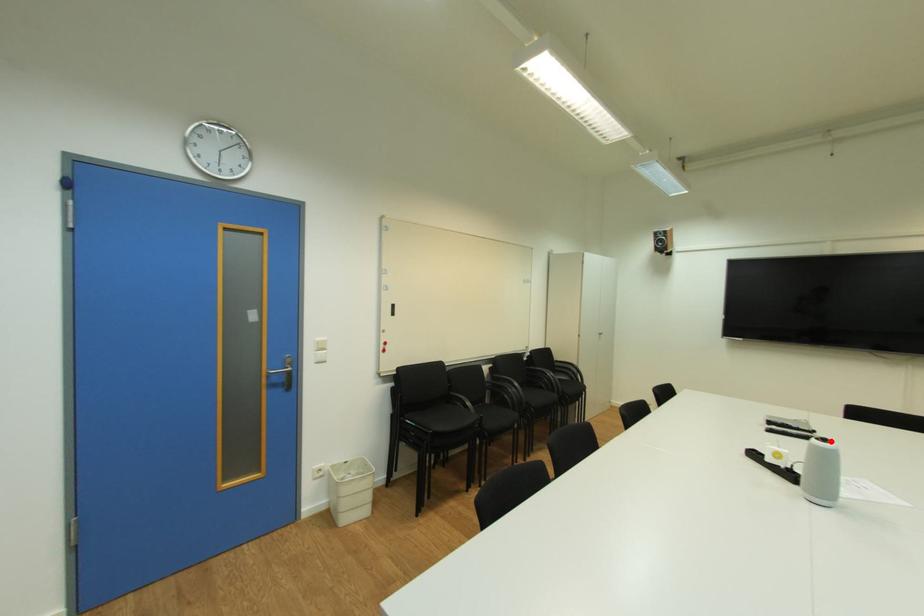
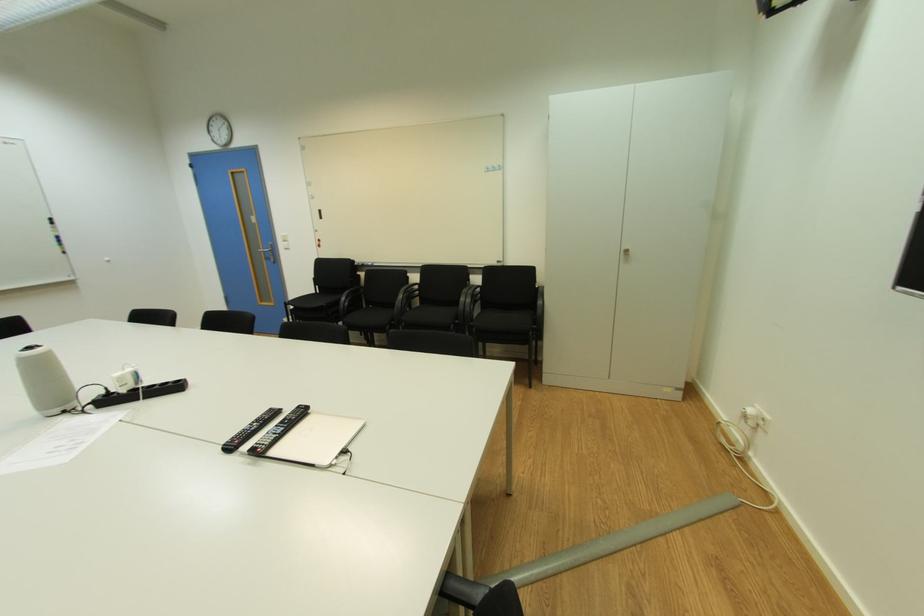
In the second image, find the point that corresponds to the highlighted location in the first image.

(34, 349)